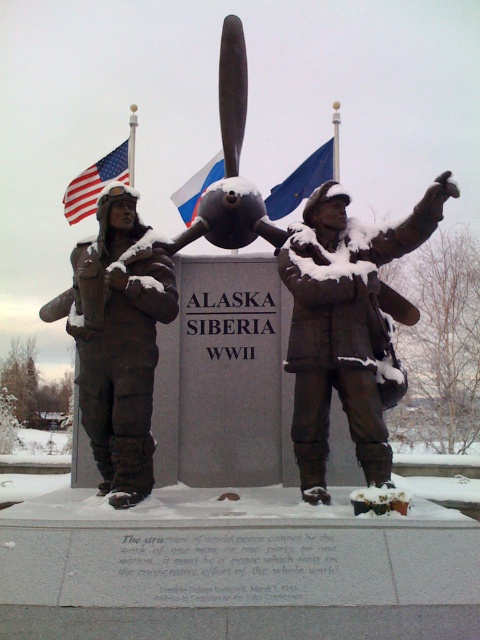
Does american flag at upper left appear over blue fabric flag at upper center?

Indeed, american flag at upper left is positioned over blue fabric flag at upper center.

Is point (129, 154) closer to viewer compared to point (315, 182)?

No, it is behind (315, 182).

The height and width of the screenshot is (640, 480). Describe the element at coordinates (98, 180) in the screenshot. I see `american flag at upper left` at that location.

You are a GUI agent. You are given a task and a screenshot of the screen. Output one action in this format:
    pyautogui.click(x=<x>, y=<y>)
    Task: Click on the american flag at upper left
    The height and width of the screenshot is (640, 480).
    Given the screenshot: What is the action you would take?
    pyautogui.click(x=98, y=180)

Can you confirm if bronze statue of soldier at left is wider than blue fabric flag at upper center?

No, bronze statue of soldier at left is not wider than blue fabric flag at upper center.

Can you confirm if bronze statue of soldier at left is shorter than blue fabric flag at upper center?

No.

Is point (156, 346) positioned after point (315, 182)?

No, it is not.

Where is `bronze statue of soldier at left`? The image size is (480, 640). bronze statue of soldier at left is located at coordinates pos(120,340).

Who is more forward, (354, 230) or (124, 170)?

Point (354, 230) is in front.

Can you confirm if bronze statue at right is wider than american flag at upper left?

Incorrect, bronze statue at right's width does not surpass american flag at upper left's.

Who is more forward, (x=294, y=436) or (x=116, y=179)?

Point (x=294, y=436)

The height and width of the screenshot is (640, 480). I want to click on bronze statue at right, so click(347, 326).